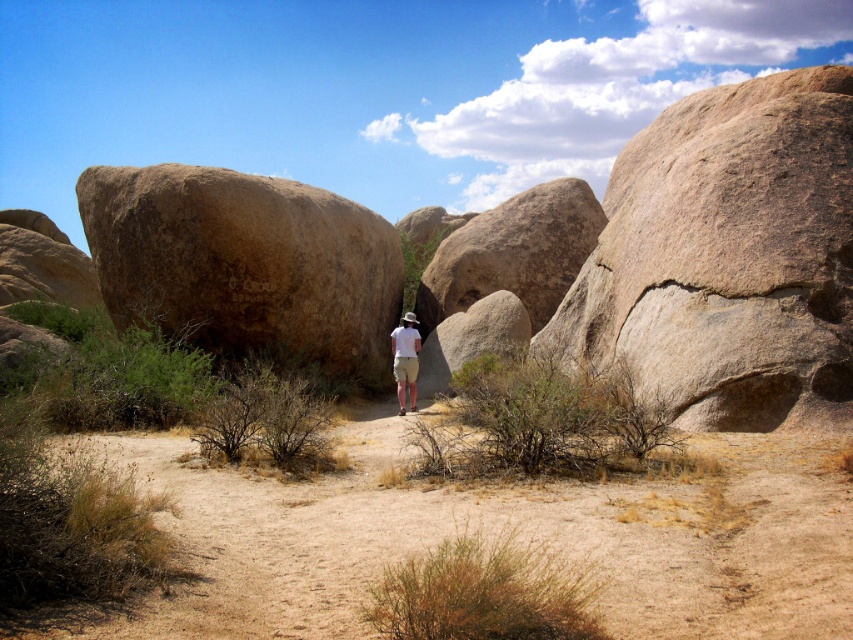
Question: Which object is farther from the camera taking this photo?

Choices:
 (A) white cotton shirt at center
 (B) granite boulder at right

Answer: (A)

Question: Estimate the real-world distances between objects in this image. Which object is closer to the brown rough rock at left?

Choices:
 (A) white cotton shirt at center
 (B) brown sandy ground at center

Answer: (A)

Question: Does brown rough rock at left appear on the right side of white cotton shirt at center?

Choices:
 (A) no
 (B) yes

Answer: (A)

Question: Which of the following is the farthest from the observer?

Choices:
 (A) (325, 266)
 (B) (415, 369)
 (C) (764, 340)

Answer: (A)

Question: Is brown sandy ground at center positioned in front of white cotton shirt at center?

Choices:
 (A) yes
 (B) no

Answer: (A)

Question: Is brown rough rock at left smaller than white cotton shirt at center?

Choices:
 (A) yes
 (B) no

Answer: (B)